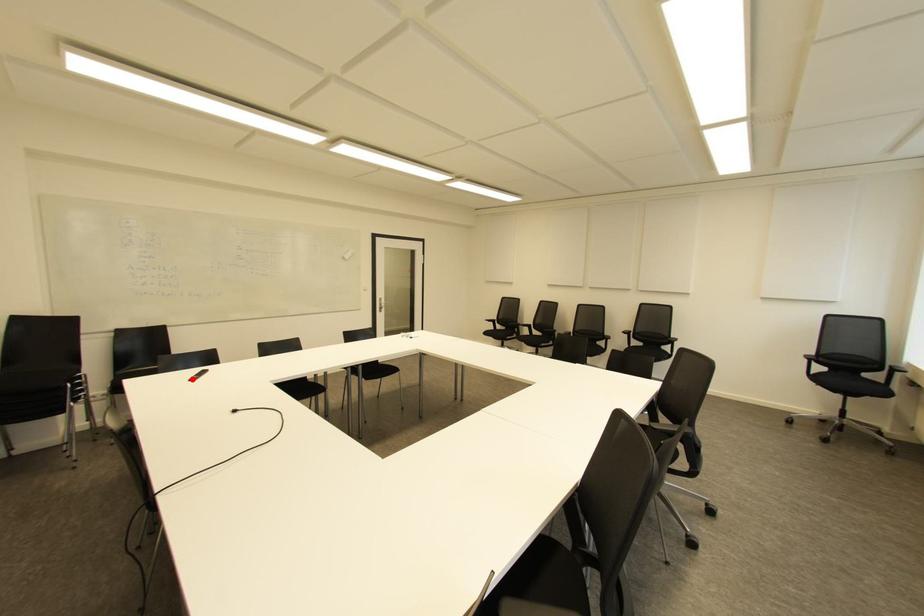
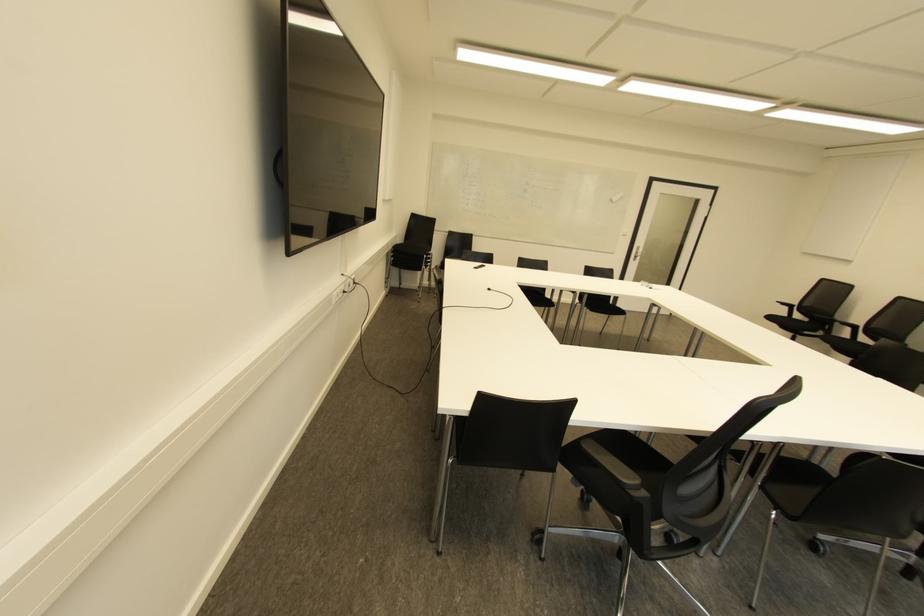
Find the pixel in the second image that matches the highlighted location in the first image.

(475, 268)